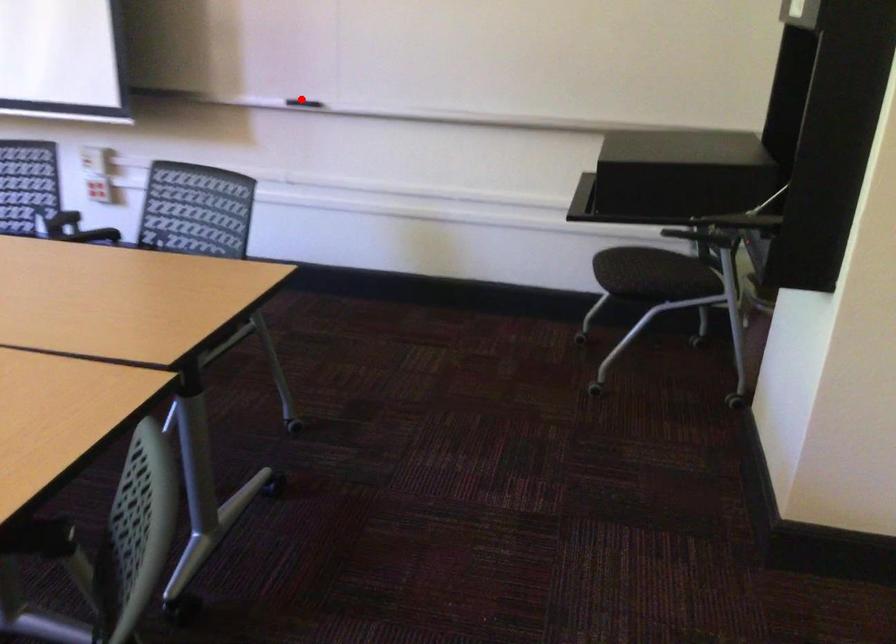
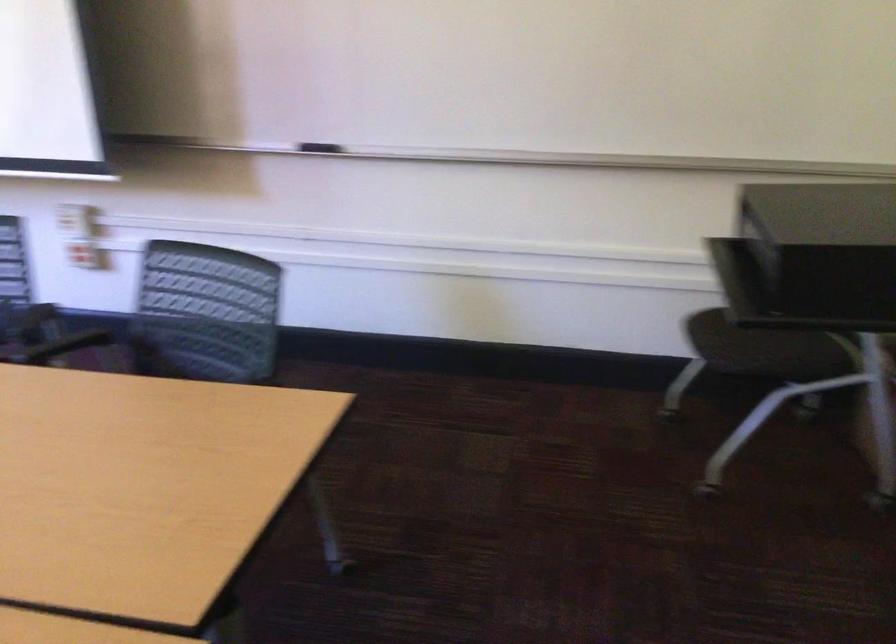
Question: I am providing you with two images of the same scene from different viewpoints. Given a red point in image1, look at the same physical point in image2. Is it:

Choices:
 (A) Closer to the viewpoint
 (B) Farther from the viewpoint

Answer: (A)